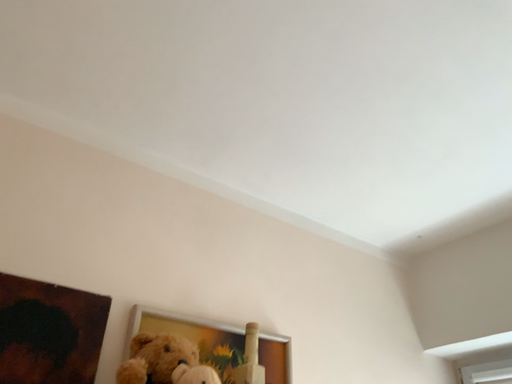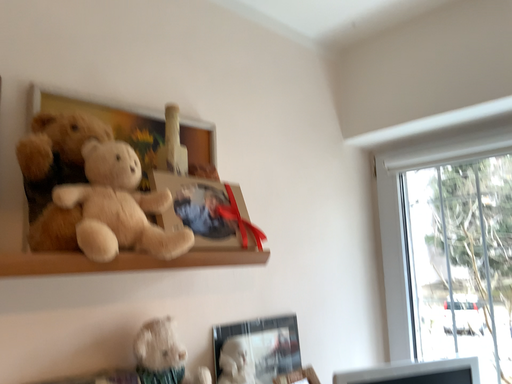
Question: How did the camera likely rotate when shooting the video?

Choices:
 (A) rotated right
 (B) rotated left

Answer: (A)